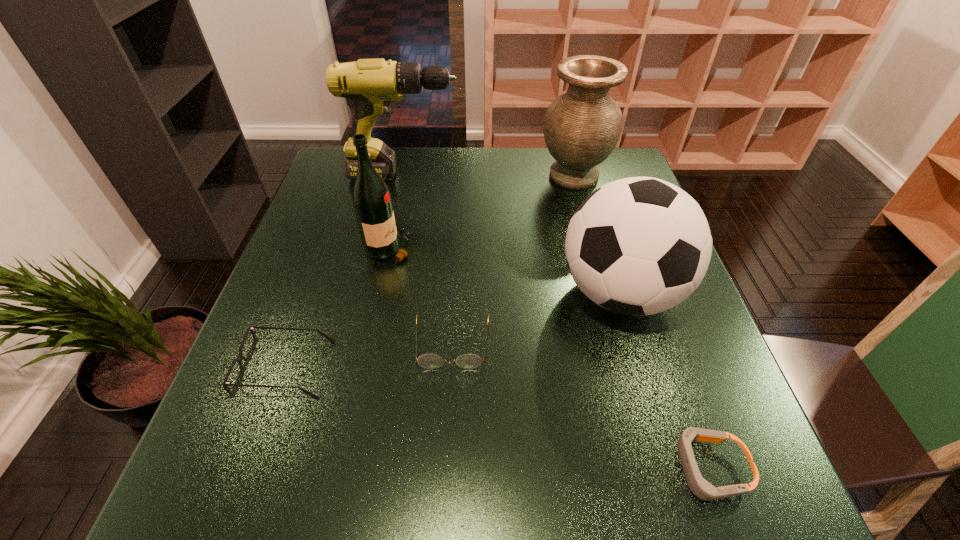
Find the location of `vacant point located on the surface of the wine bottle`. vacant point located on the surface of the wine bottle is located at coordinates (556, 248).

What are the coordinates of `free region located on the left of the soccer ball` in the screenshot? It's located at (415, 293).

Locate an element on the screen. The width and height of the screenshot is (960, 540). blank area located on the temples of the right spectacles is located at coordinates (447, 439).

You are a GUI agent. You are given a task and a screenshot of the screen. Output one action in this format:
    pyautogui.click(x=<x>, y=<y>)
    Task: Click on the blank space located 0.190m with the lenses facing outward on the left spectacles
    
    Given the screenshot: What is the action you would take?
    pyautogui.click(x=427, y=369)

I want to click on vacant space located 0.260m on the front and back of the nearest object, so click(511, 468).

The width and height of the screenshot is (960, 540). What are the coordinates of `vacant region located 0.400m on the front and back of the nearest object` in the screenshot? It's located at (424, 468).

The image size is (960, 540). I want to click on vacant space located 0.360m on the front and back of the nearest object, so click(449, 468).

Identify the location of drill at the far edge. This screenshot has height=540, width=960. (372, 84).

This screenshot has width=960, height=540. Identify the location of vase that is at the far edge. tap(582, 126).

Image resolution: width=960 pixels, height=540 pixels. Find the location of `object positioned at the near edge`. object positioned at the near edge is located at coordinates (701, 488).